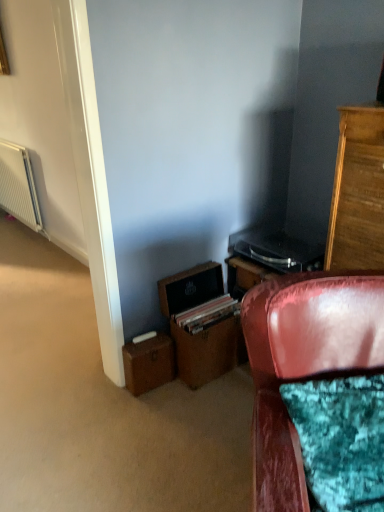
Question: Is white textured radiator at left at the left side of velvet red chair at lower right?

Choices:
 (A) yes
 (B) no

Answer: (A)

Question: Is white textured radiator at left not close to velvet red chair at lower right?

Choices:
 (A) yes
 (B) no

Answer: (A)

Question: From the image's perspective, is white textured radiator at left under velvet red chair at lower right?

Choices:
 (A) yes
 (B) no

Answer: (B)

Question: Is white textured radiator at left completely or partially outside of velvet red chair at lower right?

Choices:
 (A) no
 (B) yes

Answer: (B)

Question: From a real-world perspective, is white textured radiator at left positioned under velvet red chair at lower right based on gravity?

Choices:
 (A) no
 (B) yes

Answer: (A)

Question: Is velvet red chair at lower right bigger or smaller than white textured radiator at left?

Choices:
 (A) small
 (B) big

Answer: (B)

Question: In terms of width, does velvet red chair at lower right look wider or thinner when compared to white textured radiator at left?

Choices:
 (A) wide
 (B) thin

Answer: (A)

Question: Considering the relative positions of velvet red chair at lower right and white textured radiator at left in the image provided, is velvet red chair at lower right to the left or to the right of white textured radiator at left?

Choices:
 (A) right
 (B) left

Answer: (A)

Question: Is point (302, 505) closer or farther from the camera than point (23, 197)?

Choices:
 (A) closer
 (B) farther

Answer: (A)

Question: Choose the correct answer: Is brown cardboard drawer at lower center inside brown leather file cabinet at lower center or outside it?

Choices:
 (A) inside
 (B) outside

Answer: (A)

Question: From the image's perspective, relative to brown leather file cabinet at lower center, is brown cardboard drawer at lower center above or below?

Choices:
 (A) below
 (B) above

Answer: (A)

Question: Considering the positions of brown cardboard drawer at lower center and brown leather file cabinet at lower center in the image, is brown cardboard drawer at lower center bigger or smaller than brown leather file cabinet at lower center?

Choices:
 (A) big
 (B) small

Answer: (B)

Question: Considering the positions of brown cardboard drawer at lower center and brown leather file cabinet at lower center in the image, is brown cardboard drawer at lower center taller or shorter than brown leather file cabinet at lower center?

Choices:
 (A) tall
 (B) short

Answer: (B)

Question: Considering the positions of brown leather file cabinet at lower center and brown cardboard drawer at lower center in the image, is brown leather file cabinet at lower center taller or shorter than brown cardboard drawer at lower center?

Choices:
 (A) short
 (B) tall

Answer: (B)

Question: In terms of width, does brown leather file cabinet at lower center look wider or thinner when compared to brown cardboard drawer at lower center?

Choices:
 (A) wide
 (B) thin

Answer: (A)